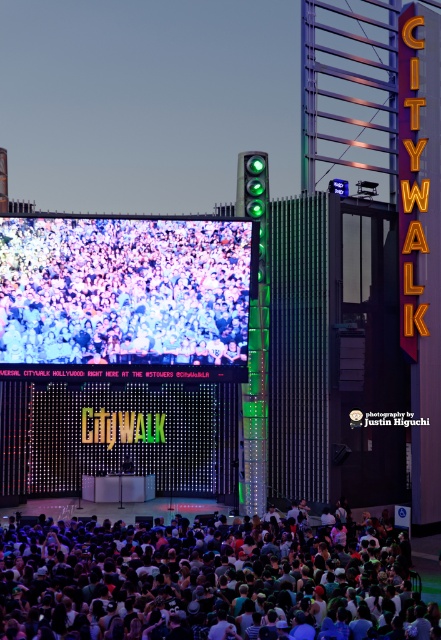
Question: Can you confirm if dark gray fabric crowd at lower center is positioned above multicolored fabric crowd at center?

Choices:
 (A) yes
 (B) no

Answer: (B)

Question: Is dark gray fabric crowd at lower center bigger than multicolored fabric crowd at center?

Choices:
 (A) no
 (B) yes

Answer: (B)

Question: Does dark gray fabric crowd at lower center have a larger size compared to multicolored fabric crowd at center?

Choices:
 (A) no
 (B) yes

Answer: (B)

Question: Among these points, which one is farthest from the camera?

Choices:
 (A) (134, 296)
 (B) (273, 563)

Answer: (A)